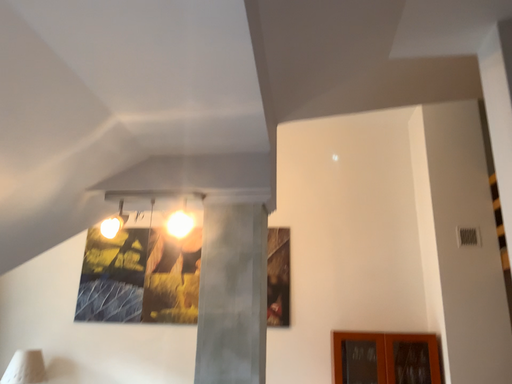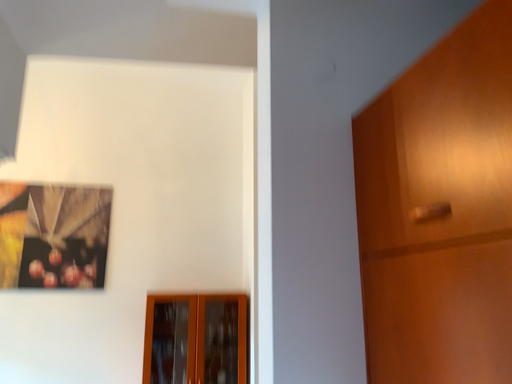
Question: Which way did the camera rotate in the video?

Choices:
 (A) rotated left
 (B) rotated right

Answer: (B)